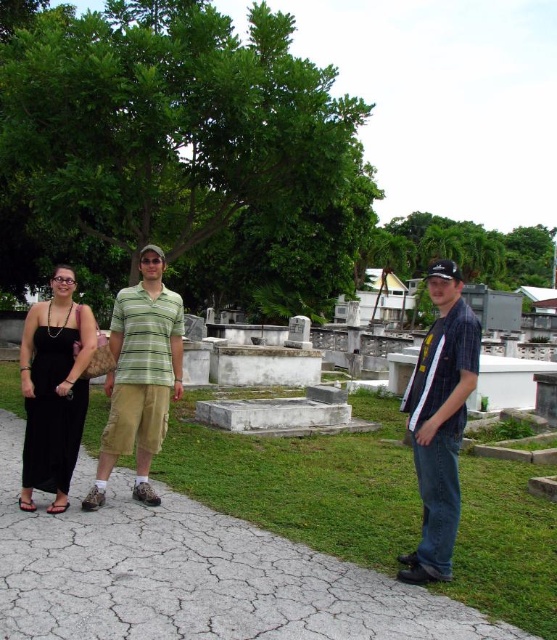
What is located at the coordinates point (439, 420) in the image?

The striped cotton shirt at center is located at point (439, 420).

You are standing at the entrance of the cemetery and see the cracked concrete path at center and the black satin dress at left. Which object is closer to you?

The cracked concrete path at center is closer to you because it is in front of the black satin dress at left.

Based on the photo, you are planning to walk along the cracked concrete path at center while carrying a large box that is as wide as the black satin dress at left. Will the box fit on the path?

The cracked concrete path at center is thinner than the black satin dress at left. Since the box is as wide as the black satin dress at left, the path is not wide enough to accommodate the box.